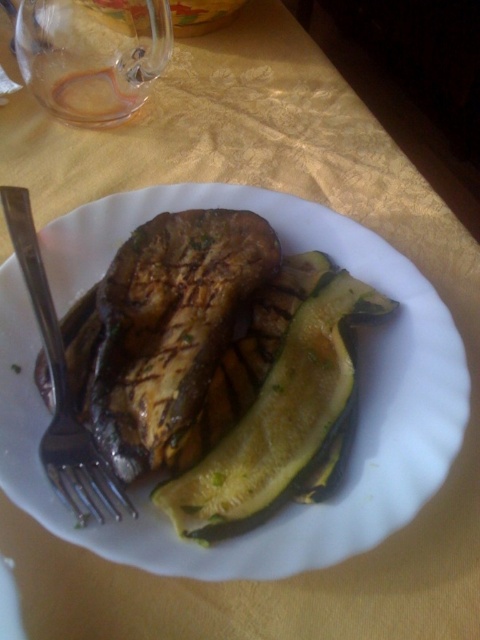
You are standing at the viewer position and want to reach the point marked at coordinates (332, 540). If your hand can extend 40 centimeters forward, will you be able to touch that point?

The point at (332, 540) is 41.34 centimeters away from the viewer, which is slightly beyond the 40 centimeter reach of your hand. Therefore, you cannot touch the point with your current reach.

You are a chef holding a knife and want to cut the grilled eggplant on the left side of the plate. The point at coordinate (365, 513) is where you need to place your knife to make the cut. If your knife is 15 centimeters long, will it reach from your current position to that point?

The point at coordinate (365, 513) is 43.14 centimeters away from the viewer. Since the knife is only 15 centimeters long, it will not reach that point.

You are a food critic examining this plate of grilled vegetables. You notice the slightly charred eggplant at center and the silver metallic fork at lower left. Based on their positions, which object is closer to the left edge of the plate?

The silver metallic fork at lower left is closer to the left edge of the plate because it is positioned to the left of the slightly charred eggplant at center.